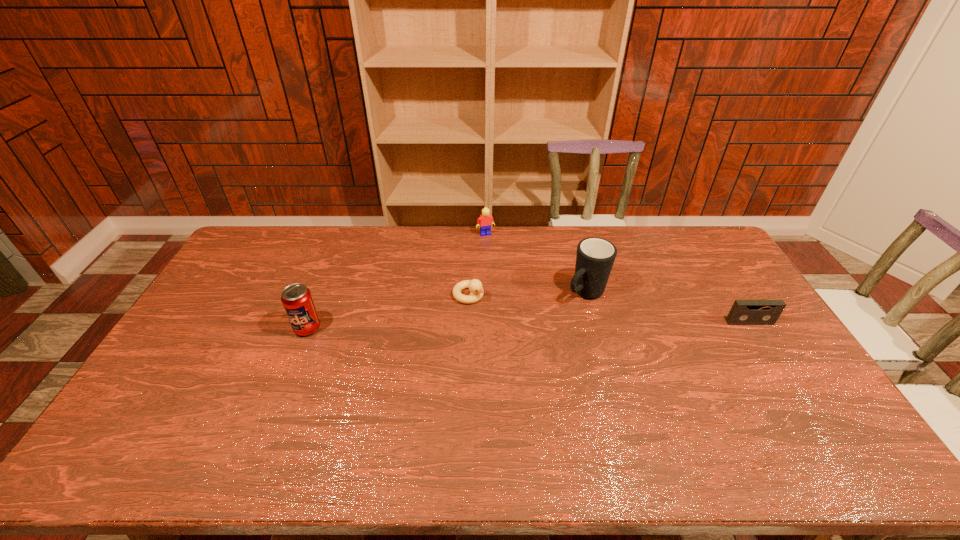
Locate an element on the screen. The height and width of the screenshot is (540, 960). vacant space at the far edge is located at coordinates (581, 234).

This screenshot has height=540, width=960. In the image, there is a desktop. What are the coordinates of `vacant region at the near edge` in the screenshot? It's located at (774, 427).

Locate an element on the screen. vacant point at the left edge is located at coordinates [220, 291].

The width and height of the screenshot is (960, 540). I want to click on free space at the far right corner of the desktop, so click(710, 255).

Image resolution: width=960 pixels, height=540 pixels. Find the location of `blank space at the near right corner`. blank space at the near right corner is located at coordinates (828, 408).

This screenshot has width=960, height=540. Find the location of `free space between the rightmost object and the duckling`. free space between the rightmost object and the duckling is located at coordinates (609, 308).

Locate an element on the screen. vacant space that's between the mug and the leftmost object is located at coordinates (446, 310).

Where is `empty space that is in between the second object from right to left and the videotape`? empty space that is in between the second object from right to left and the videotape is located at coordinates (667, 308).

The height and width of the screenshot is (540, 960). I want to click on vacant area that lies between the soda can and the rightmost object, so click(x=529, y=325).

What are the coordinates of `empty location between the Lego and the leftmost object` in the screenshot? It's located at (396, 281).